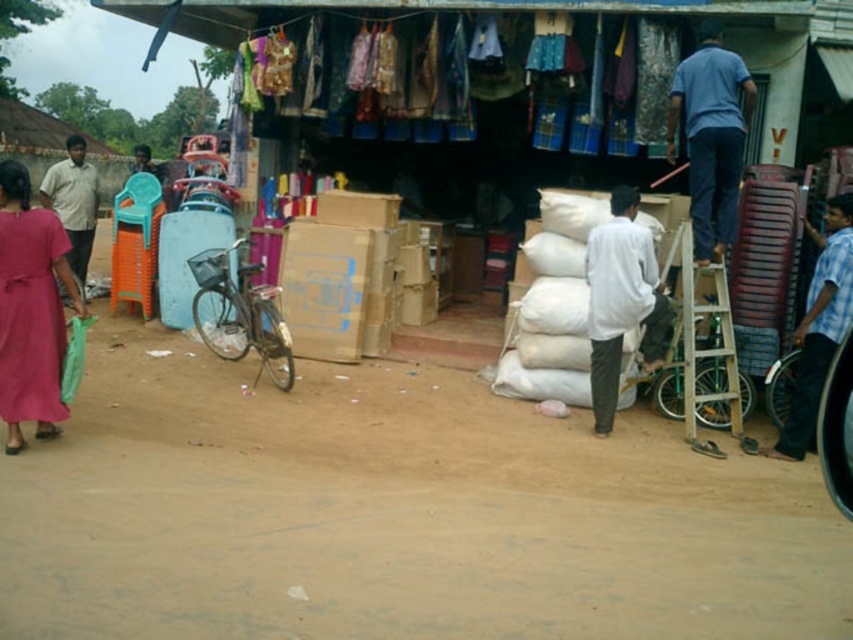
Is blue cotton shirt at upper center to the right of blue checkered shirt at right from the viewer's perspective?

In fact, blue cotton shirt at upper center is to the left of blue checkered shirt at right.

Which is above, blue cotton shirt at upper center or blue checkered shirt at right?

blue cotton shirt at upper center

Which is in front, point (698, 240) or point (821, 320)?

Point (821, 320) is in front.

Where is `blue cotton shirt at upper center`? blue cotton shirt at upper center is located at coordinates (711, 136).

Is matte pink dress at lower left closer to the viewer compared to white matte shirt at center?

Yes, matte pink dress at lower left is in front of white matte shirt at center.

Which is in front, point (33, 269) or point (642, 340)?

Point (33, 269)

At what (x,y) coordinates should I click in order to perform the action: click on matte pink dress at lower left. Please return your answer as a coordinate pair (x, y). This screenshot has width=853, height=640. Looking at the image, I should click on (32, 308).

Does point (814, 362) come in front of point (74, 154)?

Yes, it is in front of point (74, 154).

Is point (772, 456) positioned behind point (73, 244)?

No, (772, 456) is closer to viewer.

Is point (846, 276) closer to camera compared to point (62, 186)?

Yes, point (846, 276) is closer to viewer.

In order to click on blue checkered shirt at right in this screenshot , I will do `click(819, 326)`.